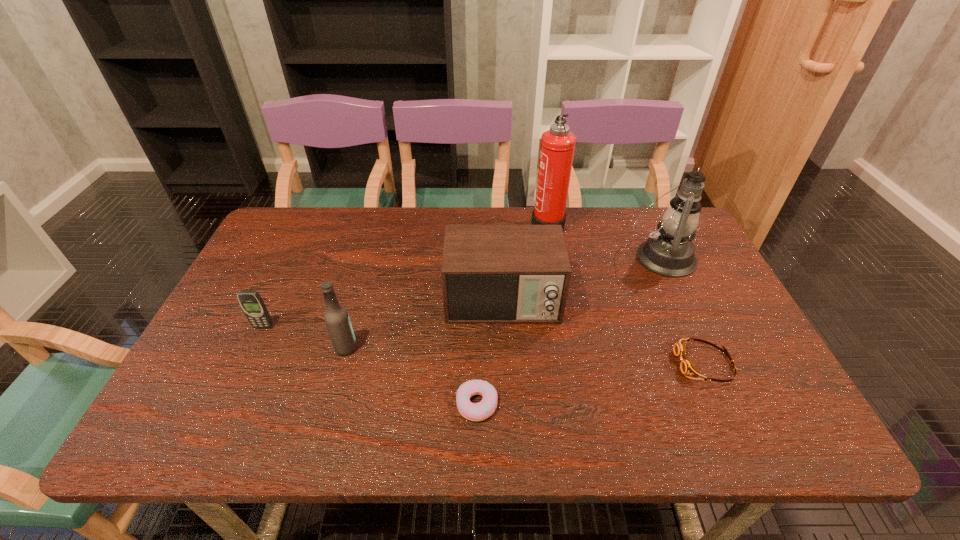
Locate an element on the screen. The width and height of the screenshot is (960, 540). fire extinguisher is located at coordinates (557, 147).

Where is `the sixth shortest object`? Image resolution: width=960 pixels, height=540 pixels. the sixth shortest object is located at coordinates (669, 252).

Identify the location of the second object from left to right. Image resolution: width=960 pixels, height=540 pixels. [336, 317].

This screenshot has height=540, width=960. In order to click on the fifth shortest object in this screenshot , I will do `click(336, 317)`.

This screenshot has width=960, height=540. I want to click on the fourth tallest object, so click(490, 273).

I want to click on cellular telephone, so click(x=252, y=304).

Identify the location of the fifth tallest object. (252, 304).

Locate an element on the screen. The width and height of the screenshot is (960, 540). goggles is located at coordinates (687, 367).

Identify the location of doughnut. This screenshot has height=540, width=960. (485, 408).

Image resolution: width=960 pixels, height=540 pixels. I want to click on the shortest object, so click(x=485, y=408).